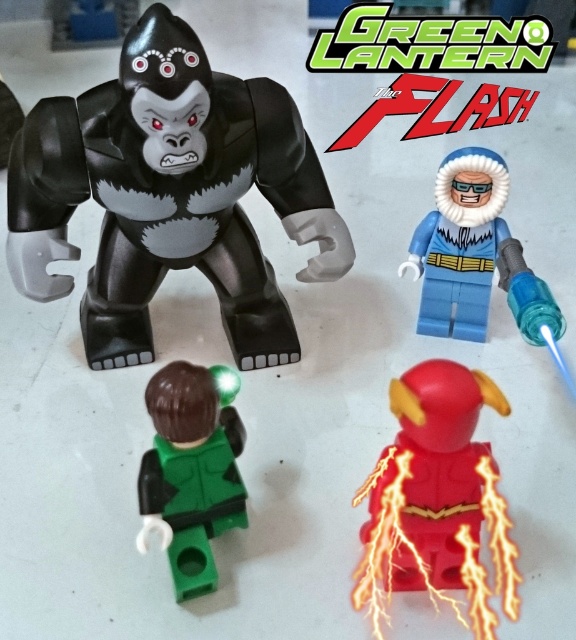
Who is more distant from viewer, [183,429] or [389,106]?

The point [389,106] is more distant.

Which of these two, green matte/glossy figure at lower left or green glossy text at upper center, stands shorter?

With less height is green glossy text at upper center.

Between point (218, 504) and point (499, 115), which one is positioned in front?

Positioned in front is point (218, 504).

Locate an element on the screen. This screenshot has height=640, width=576. green matte/glossy figure at lower left is located at coordinates pyautogui.click(x=191, y=468).

Can you confirm if red matte lightning bolt at center is positioned to the left of blue matte jacket at upper right?

Indeed, red matte lightning bolt at center is positioned on the left side of blue matte jacket at upper right.

Is red matte lightning bolt at center behind blue matte jacket at upper right?

No, it is not.

The width and height of the screenshot is (576, 640). I want to click on red matte lightning bolt at center, so click(437, 500).

Image resolution: width=576 pixels, height=640 pixels. What are the coordinates of `red matte lightning bolt at center` in the screenshot? It's located at (437, 500).

Which of these two, matte black gorilla at upper left or green glossy text at upper center, stands shorter?

green glossy text at upper center

Which is more to the right, matte black gorilla at upper left or green glossy text at upper center?

From the viewer's perspective, green glossy text at upper center appears more on the right side.

This screenshot has width=576, height=640. What do you see at coordinates (169, 195) in the screenshot? I see `matte black gorilla at upper left` at bounding box center [169, 195].

In order to click on matte black gorilla at upper left in this screenshot , I will do `click(169, 195)`.